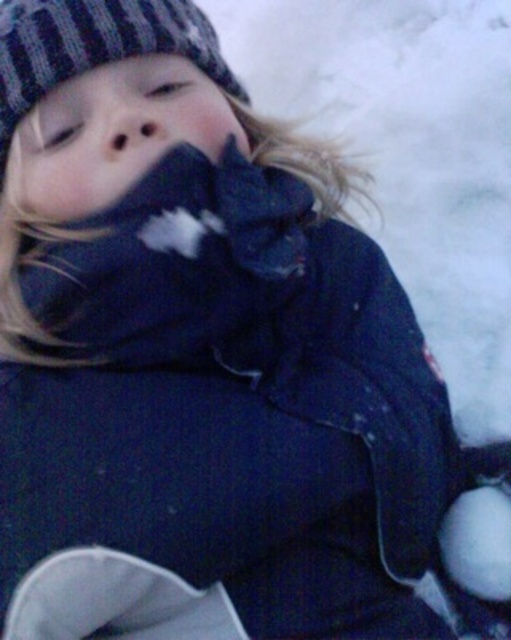
You are a photographer trying to capture the perfect shot of the child in the snow. You notice the white fluffy snowball at lower right and the matte black nose at center. Which object is positioned to the right of the other?

The white fluffy snowball at lower right is to the right of the matte black nose at center.

You are a photographer trying to capture a clear shot of the child in the snowy scene. You notice the knitted woolen hat at upper left and the matte black nose at center. Which object is closer to the camera?

The matte black nose at center is behind the knitted woolen hat at upper left, so the knitted woolen hat at upper left is closer to the camera.

You are a photographer taking a picture of the child in the snowy environment. You need to ensure both the white fluffy snowball at lower right and the matte black nose at center are clearly visible in the photo. Considering their sizes, which object might require closer attention to focus on to ensure clarity?

The matte black nose at center requires closer attention to focus on for clarity because it is smaller in height compared to the white fluffy snowball at lower right.